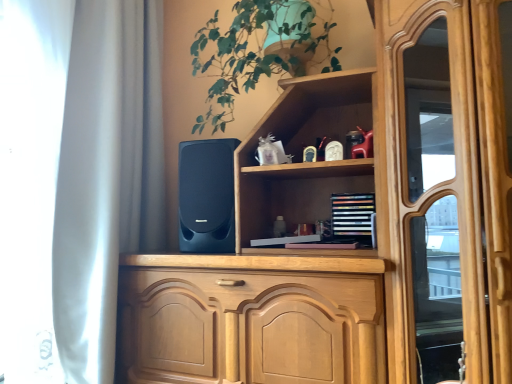
Question: From the image's perspective, is matte black speaker at center above or below white matte curtain at left?

Choices:
 (A) above
 (B) below

Answer: (B)

Question: Is matte black speaker at center taller or shorter than white matte curtain at left?

Choices:
 (A) short
 (B) tall

Answer: (A)

Question: Which is nearer to the white matte curtain at left?

Choices:
 (A) green leafy plant at upper center
 (B) matte black speaker at center
 (C) multicolored wooden bookshelf at upper center

Answer: (B)

Question: Based on their relative distances, which object is nearer to the green leafy plant at upper center?

Choices:
 (A) white matte curtain at left
 (B) multicolored wooden bookshelf at upper center
 (C) matte black speaker at center

Answer: (C)